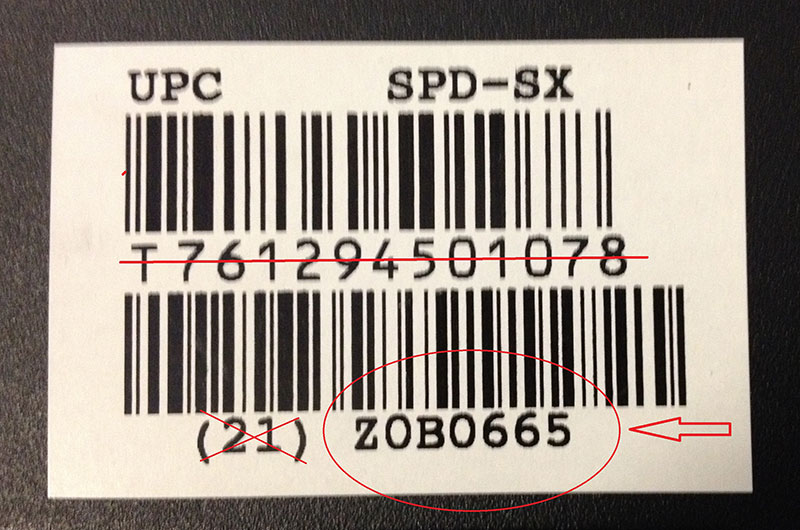
Where is `background sticker beige`? This screenshot has height=530, width=800. background sticker beige is located at coordinates (704, 119).